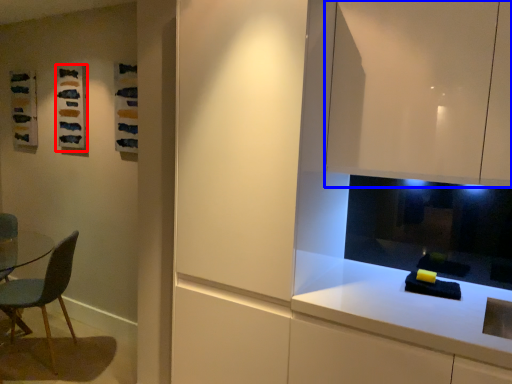
Question: Which point is closer to the camera, art (highlighted by a red box) or cabinetry (highlighted by a blue box)?

Choices:
 (A) art
 (B) cabinetry

Answer: (B)